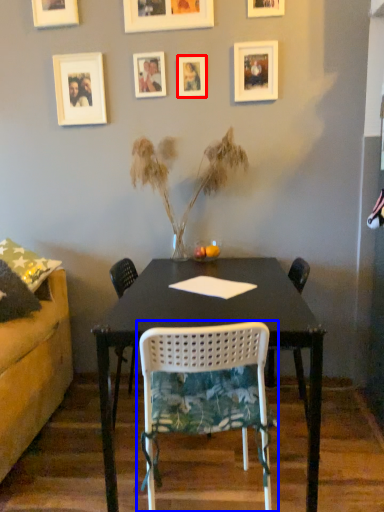
Question: Among these objects, which one is nearest to the camera, picture frame (highlighted by a red box) or chair (highlighted by a blue box)?

Choices:
 (A) picture frame
 (B) chair

Answer: (B)